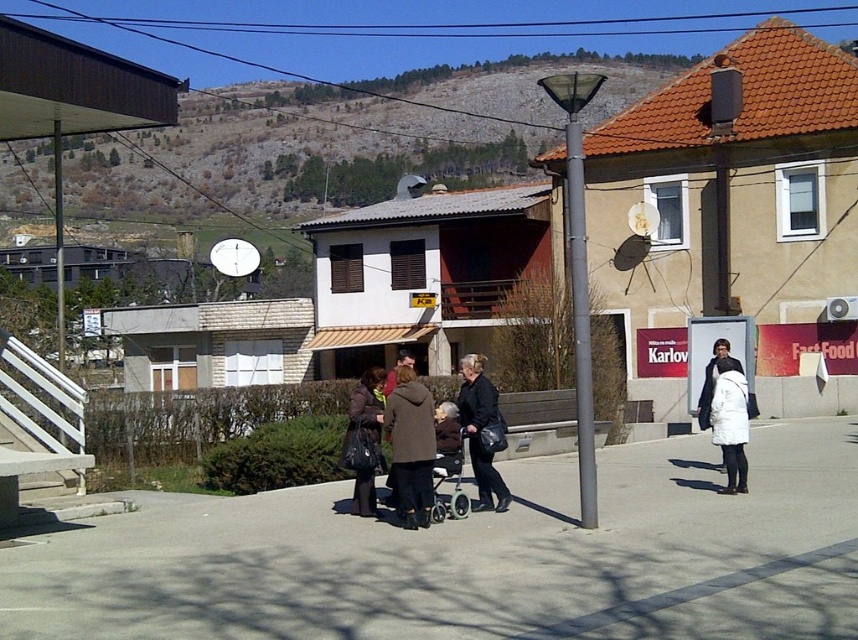
Question: Can you confirm if white matte coat at lower right is positioned to the left of matte brown coat at center?

Choices:
 (A) no
 (B) yes

Answer: (A)

Question: Which is farther from the dark gray coat at center?

Choices:
 (A) white matte coat at lower right
 (B) matte brown coat at center
 (C) brown wool coat at center
 (D) brown leather coat at center

Answer: (A)

Question: Which point is closer to the camera?

Choices:
 (A) (438, 508)
 (B) (470, 371)

Answer: (A)

Question: Can you confirm if white matte coat at lower right is bigger than metallic gray baby carriage at center?

Choices:
 (A) yes
 (B) no

Answer: (A)

Question: Is gray concrete pavement at center in front of matte brown coat at center?

Choices:
 (A) yes
 (B) no

Answer: (A)

Question: Which point is farther from the camera taking this photo?

Choices:
 (A) (432, 508)
 (B) (468, 410)

Answer: (B)